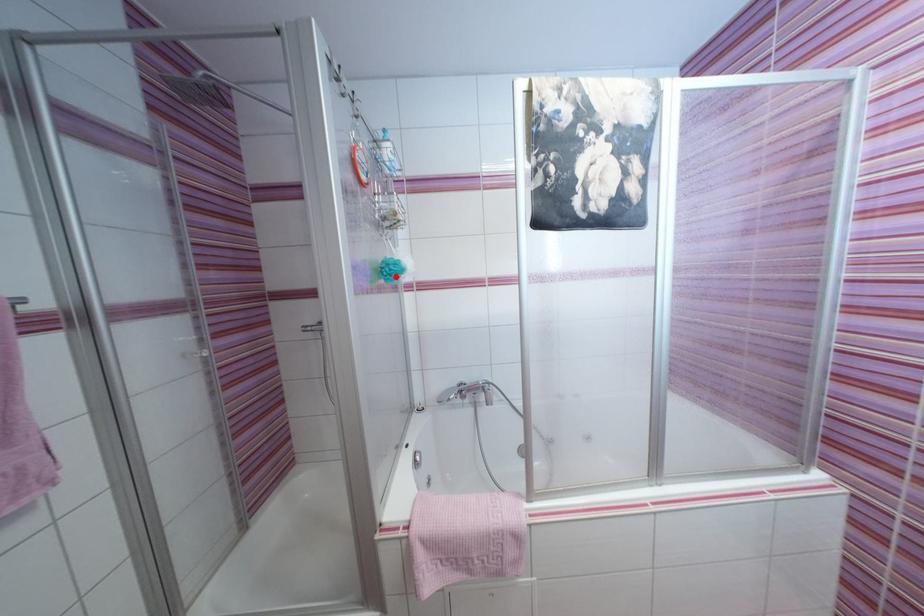
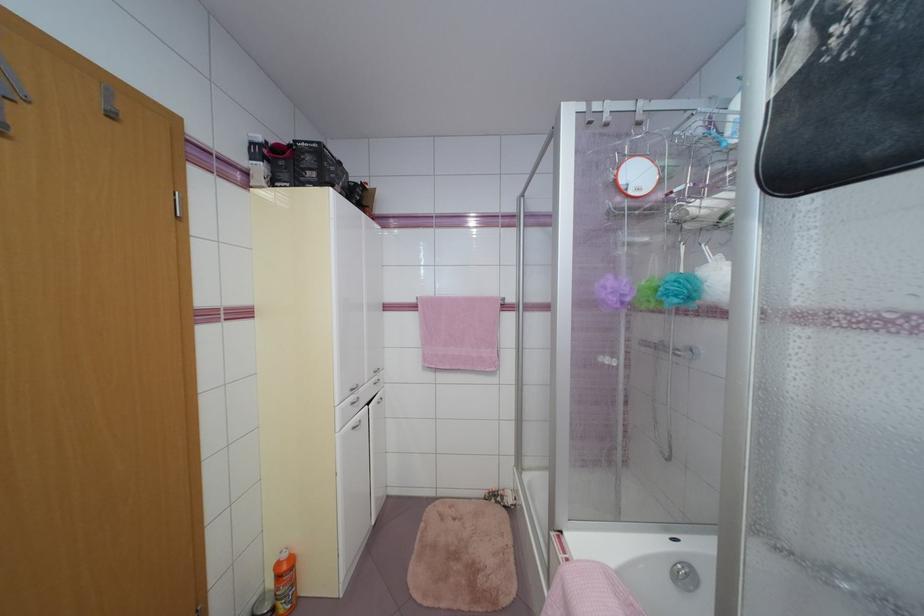
The point at the highlighted location is marked in the first image. Where is the corresponding point in the second image?

(674, 298)